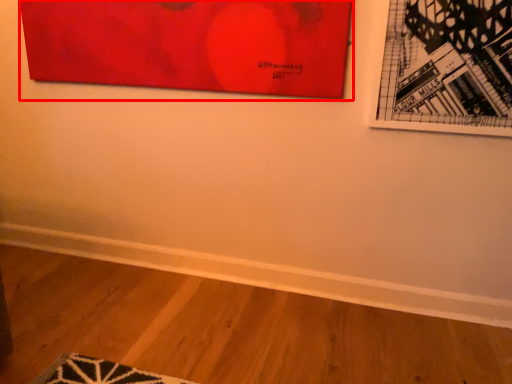
Question: From the image's perspective, what is the correct spatial positioning of picture frame (annotated by the red box) in reference to picture frame?

Choices:
 (A) above
 (B) below

Answer: (A)